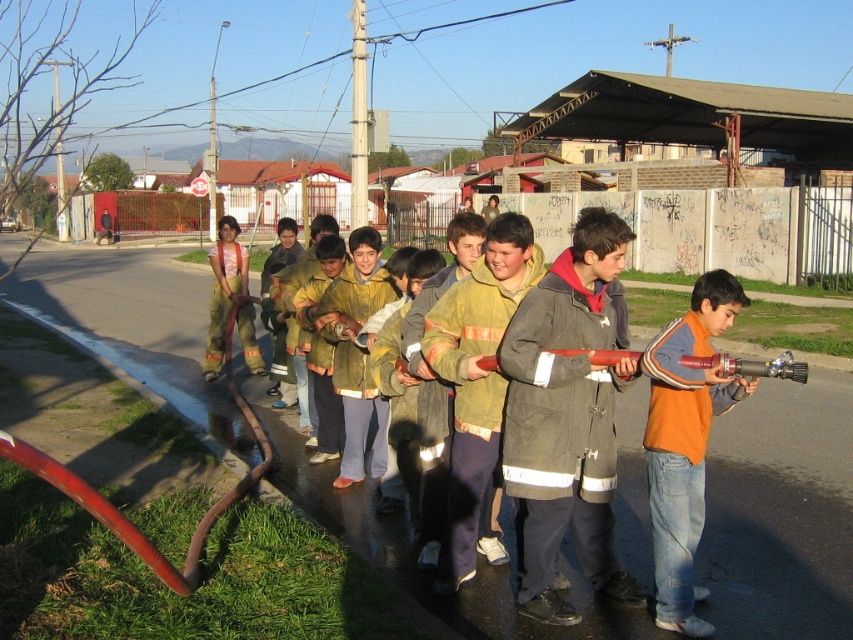
Question: Which point is farther to the camera?

Choices:
 (A) yellow fabric jacket at center
 (B) olive-green canvas jacket at center
 (C) orange fleece jacket at center
 (D) yellow fire jacket at center

Answer: (A)

Question: Where is olive-green canvas jacket at center located in relation to orange fleece jacket at center in the image?

Choices:
 (A) below
 (B) above

Answer: (B)

Question: Estimate the real-world distances between objects in this image. Which object is farther from the olive-green canvas jacket at center?

Choices:
 (A) orange fleece jacket at center
 (B) yellow fabric jacket at center

Answer: (B)

Question: Among these objects, which one is nearest to the camera?

Choices:
 (A) yellow fabric jacket at center
 (B) yellow fire jacket at center

Answer: (B)

Question: Is olive-green canvas jacket at center to the left of yellow fire jacket at center from the viewer's perspective?

Choices:
 (A) no
 (B) yes

Answer: (A)

Question: Does orange fleece jacket at center appear under yellow fire jacket at center?

Choices:
 (A) yes
 (B) no

Answer: (A)